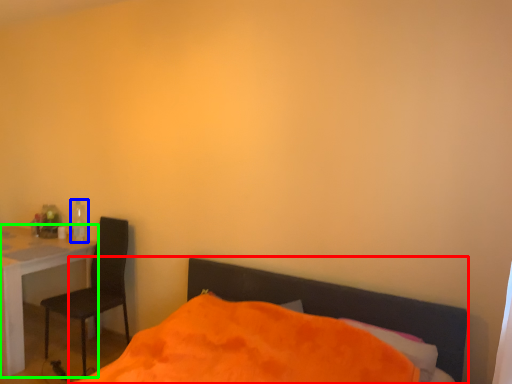
Question: Considering the real-world distances, which object is closest to bed (highlighted by a red box)? bottle (highlighted by a blue box) or desk (highlighted by a green box).

Choices:
 (A) bottle
 (B) desk

Answer: (B)